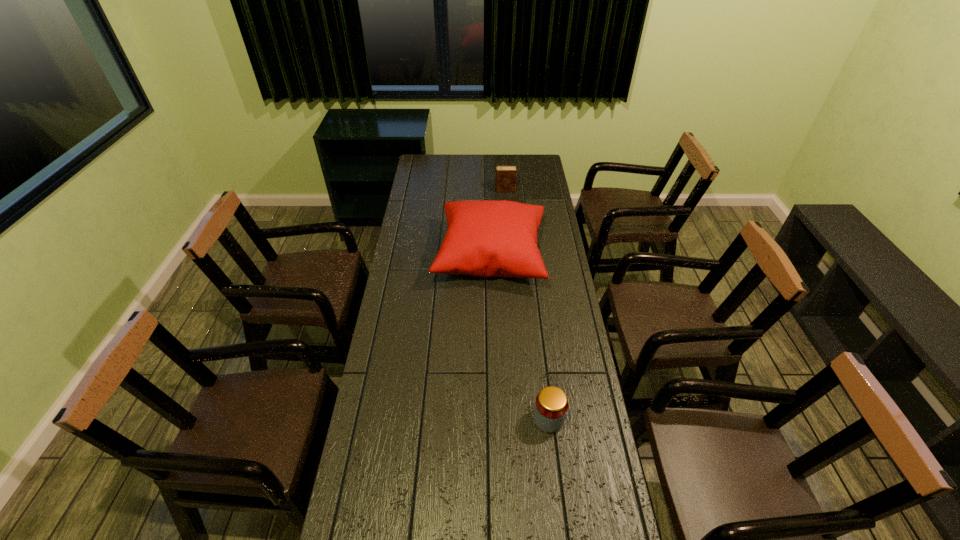
The width and height of the screenshot is (960, 540). I want to click on empty space that is in between the nearest object and the diary, so click(x=527, y=305).

Point out which object is positioned as the second nearest to the diary. Please provide its 2D coordinates. Your answer should be formatted as a tuple, i.e. [(x, y)], where the tuple contains the x and y coordinates of a point satisfying the conditions above.

[(551, 404)]

Point out which object is positioned as the second nearest to the tallest object. Please provide its 2D coordinates. Your answer should be formatted as a tuple, i.e. [(x, y)], where the tuple contains the x and y coordinates of a point satisfying the conditions above.

[(551, 404)]

I want to click on free space that satisfies the following two spatial constraints: 1. on the back side of the jar; 2. on the spine side of the diary, so click(521, 190).

Find the location of a particular element. The width and height of the screenshot is (960, 540). free space that satisfies the following two spatial constraints: 1. on the spine side of the diary; 2. on the left side of the jar is located at coordinates (522, 420).

Locate an element on the screen. The height and width of the screenshot is (540, 960). vacant area in the image that satisfies the following two spatial constraints: 1. on the spine side of the jar; 2. on the left side of the diary is located at coordinates (522, 420).

You are a GUI agent. You are given a task and a screenshot of the screen. Output one action in this format:
    pyautogui.click(x=<x>, y=<y>)
    Task: Click on the vacant position in the image that satisfies the following two spatial constraints: 1. on the spine side of the nearest object; 2. on the right side of the farthest object
    The height and width of the screenshot is (540, 960).
    Given the screenshot: What is the action you would take?
    pyautogui.click(x=522, y=420)

Locate an element on the screen. This screenshot has height=540, width=960. blank area in the image that satisfies the following two spatial constraints: 1. on the spine side of the farthest object; 2. on the front side of the second nearest object is located at coordinates (510, 256).

This screenshot has height=540, width=960. In order to click on vacant space that satisfies the following two spatial constraints: 1. on the spine side of the farthest object; 2. on the front side of the cushion in this screenshot , I will do `click(510, 256)`.